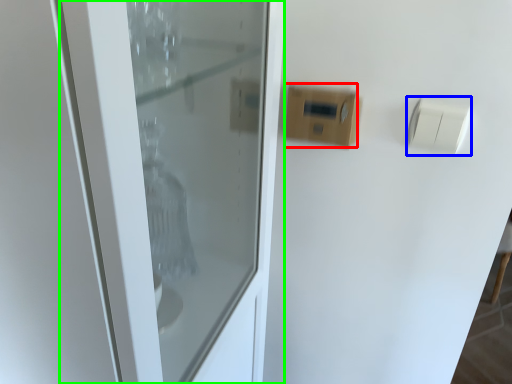
Question: Estimate the real-world distances between objects in this image. Which object is farther from light switch (highlighted by a red box), light switch (highlighted by a blue box) or door (highlighted by a green box)?

Choices:
 (A) light switch
 (B) door

Answer: (B)